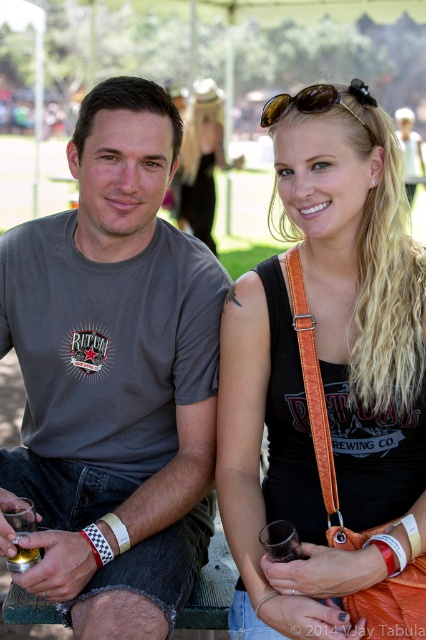
Does blonde hair at upper center appear on the left side of orange leather strap at center?

Yes, blonde hair at upper center is to the left of orange leather strap at center.

Consider the image. Does blonde hair at upper center have a lesser height compared to orange leather strap at center?

In fact, blonde hair at upper center may be taller than orange leather strap at center.

The height and width of the screenshot is (640, 426). Describe the element at coordinates (201, 161) in the screenshot. I see `blonde hair at upper center` at that location.

At what (x,y) coordinates should I click in order to perform the action: click on blonde hair at upper center. Please return your answer as a coordinate pair (x, y). The image size is (426, 640). Looking at the image, I should click on (201, 161).

Does blonde hair at upper center appear over translucent glass at lower left?

Yes, blonde hair at upper center is above translucent glass at lower left.

Which is behind, point (196, 205) or point (20, 568)?

Point (196, 205)

At what (x,y) coordinates should I click in order to perform the action: click on blonde hair at upper center. Please return your answer as a coordinate pair (x, y). Looking at the image, I should click on (201, 161).

What do you see at coordinates (328, 385) in the screenshot? The image size is (426, 640). I see `black leather tank top at upper right` at bounding box center [328, 385].

Where is `black leather tank top at upper right`? black leather tank top at upper right is located at coordinates (328, 385).

Locate an element on the screen. Image resolution: width=426 pixels, height=640 pixels. black leather tank top at upper right is located at coordinates (328, 385).